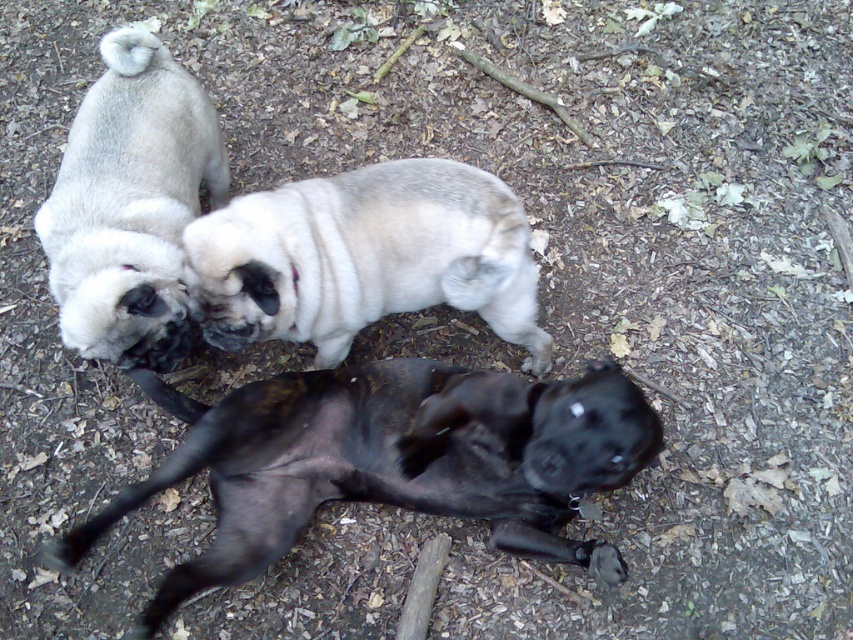
Does fuzzy beige dog at upper center have a greater width compared to matte white pug at upper left?

Yes.

Does point (222, 237) lie behind point (206, 113)?

No.

Who is more distant from viewer, (334, 214) or (134, 228)?

The point (134, 228) is more distant.

You are a GUI agent. You are given a task and a screenshot of the screen. Output one action in this format:
    pyautogui.click(x=<x>, y=<y>)
    Task: Click on the fuzzy beige dog at upper center
    
    Given the screenshot: What is the action you would take?
    pyautogui.click(x=366, y=257)

Can you confirm if black smooth dog at center is bigger than matte white pug at upper left?

Correct, black smooth dog at center is larger in size than matte white pug at upper left.

Who is positioned more to the right, black smooth dog at center or matte white pug at upper left?

Positioned to the right is black smooth dog at center.

Describe the element at coordinates (390, 461) in the screenshot. This screenshot has height=640, width=853. I see `black smooth dog at center` at that location.

Where is `black smooth dog at center`? black smooth dog at center is located at coordinates (390, 461).

Does black smooth dog at center have a greater height compared to fuzzy beige dog at upper center?

Yes.

Who is positioned more to the left, black smooth dog at center or fuzzy beige dog at upper center?

black smooth dog at center

At what (x,y) coordinates should I click in order to perform the action: click on black smooth dog at center. Please return your answer as a coordinate pair (x, y). Looking at the image, I should click on (390, 461).